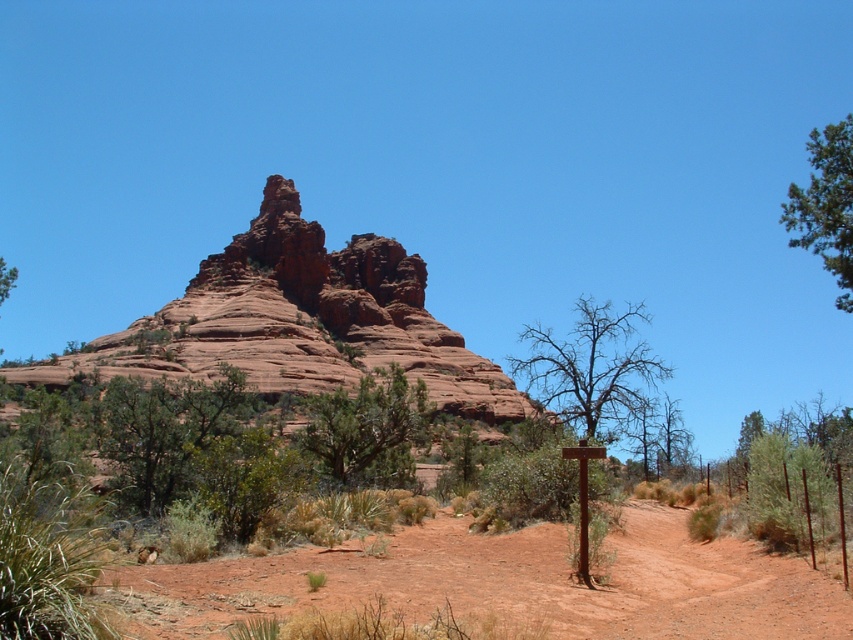
Question: Does bare wood tree at center have a larger size compared to green leafy tree at upper left?

Choices:
 (A) yes
 (B) no

Answer: (B)

Question: Based on their relative distances, which object is nearer to the green leafy tree at upper left?

Choices:
 (A) bare wood tree at center
 (B) green textured bush at center
 (C) dusty red dirt track at center
 (D) green leafy tree at upper right

Answer: (B)

Question: Which of the following is the closest to the observer?

Choices:
 (A) (10, 280)
 (B) (579, 406)
 (C) (706, 547)

Answer: (C)

Question: Can you confirm if dusty red dirt track at center is wider than bare wood tree at center?

Choices:
 (A) yes
 (B) no

Answer: (A)

Question: Is dusty red dirt track at center closer to the viewer compared to reddish-brown sandstone rock formation at center?

Choices:
 (A) no
 (B) yes

Answer: (B)

Question: Which object is positioned farthest from the green textured bush at center?

Choices:
 (A) green leafy tree at upper left
 (B) bare wood tree at center
 (C) green leafy tree at upper right

Answer: (C)